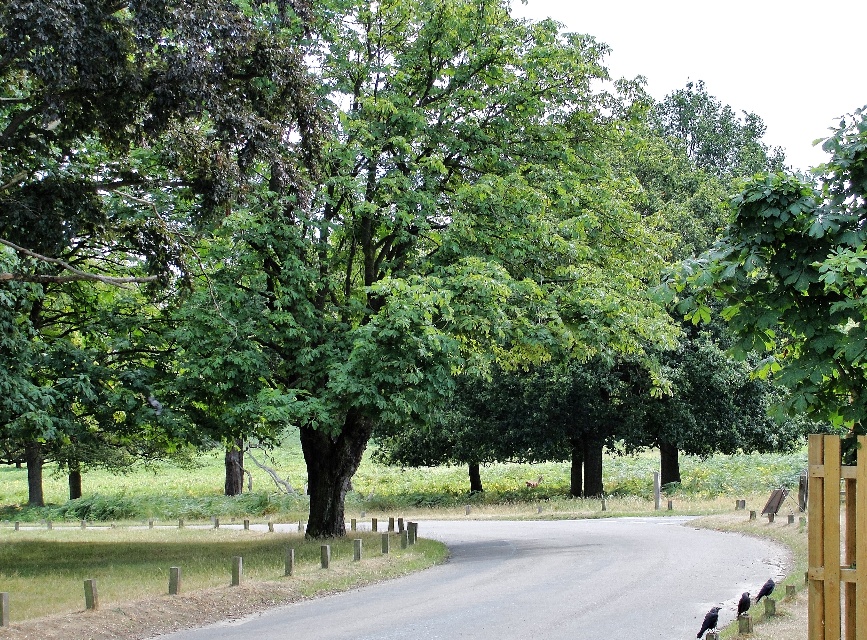
Question: In this image, where is green leafy tree at upper center located relative to wooden post at lower center?

Choices:
 (A) above
 (B) below

Answer: (A)

Question: Can you confirm if green leafy tree at upper center is bigger than brown wooden fence at right?

Choices:
 (A) yes
 (B) no

Answer: (A)

Question: Which point appears farthest from the camera in this image?

Choices:
 (A) (857, 540)
 (B) (844, 426)
 (C) (830, 502)

Answer: (B)

Question: Which object is positioned farthest from the wooden post at lower center?

Choices:
 (A) brown wooden fence at right
 (B) green leafy tree at upper center

Answer: (B)

Question: Among these objects, which one is farthest from the camera?

Choices:
 (A) light brown wooden fence at right
 (B) wooden post at lower center
 (C) brown wooden fence at right

Answer: (B)

Question: Can you confirm if brown wooden fence at right is positioned to the left of light brown wooden fence at right?

Choices:
 (A) yes
 (B) no

Answer: (B)